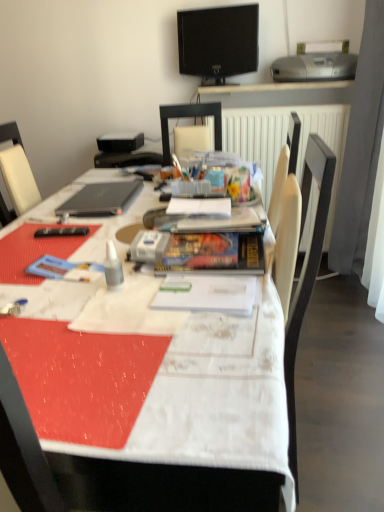
Question: Are white textured tablecloth at center and silver metallic printer at upper right located far from each other?

Choices:
 (A) no
 (B) yes

Answer: (B)

Question: Is white textured tablecloth at center outside of silver metallic printer at upper right?

Choices:
 (A) yes
 (B) no

Answer: (A)

Question: Is white textured tablecloth at center to the left of silver metallic printer at upper right from the viewer's perspective?

Choices:
 (A) yes
 (B) no

Answer: (A)

Question: From the image's perspective, does white textured tablecloth at center appear higher than silver metallic printer at upper right?

Choices:
 (A) no
 (B) yes

Answer: (A)

Question: Can you confirm if white textured tablecloth at center is thinner than silver metallic printer at upper right?

Choices:
 (A) no
 (B) yes

Answer: (A)

Question: Is white textured tablecloth at center directly adjacent to silver metallic printer at upper right?

Choices:
 (A) no
 (B) yes

Answer: (A)

Question: Considering the relative sizes of white textured tablecloth at center and black glossy tv at upper center in the image provided, is white textured tablecloth at center bigger than black glossy tv at upper center?

Choices:
 (A) yes
 (B) no

Answer: (A)

Question: Does white textured tablecloth at center have a lesser width compared to black glossy tv at upper center?

Choices:
 (A) yes
 (B) no

Answer: (B)

Question: From the image's perspective, would you say white textured tablecloth at center is shown under black glossy tv at upper center?

Choices:
 (A) yes
 (B) no

Answer: (A)

Question: From the image's perspective, would you say white textured tablecloth at center is positioned over black glossy tv at upper center?

Choices:
 (A) no
 (B) yes

Answer: (A)

Question: Is white textured tablecloth at center positioned far away from black glossy tv at upper center?

Choices:
 (A) no
 (B) yes

Answer: (B)

Question: Can you confirm if white textured tablecloth at center is smaller than black glossy tv at upper center?

Choices:
 (A) no
 (B) yes

Answer: (A)

Question: Can we say sleek black laptop at upper left lies outside white textured tablecloth at center?

Choices:
 (A) yes
 (B) no

Answer: (A)